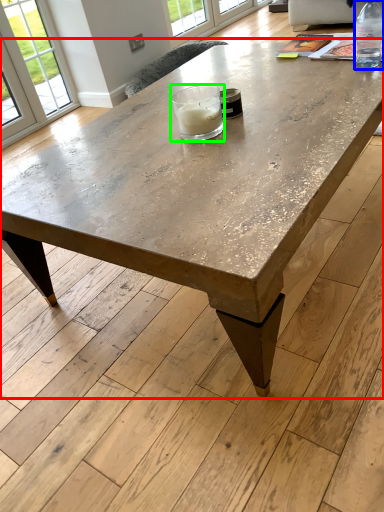
Question: Considering the real-world distances, which object is farthest from coffee table (highlighted by a red box)? bottle (highlighted by a blue box) or candle holder (highlighted by a green box)?

Choices:
 (A) bottle
 (B) candle holder

Answer: (A)